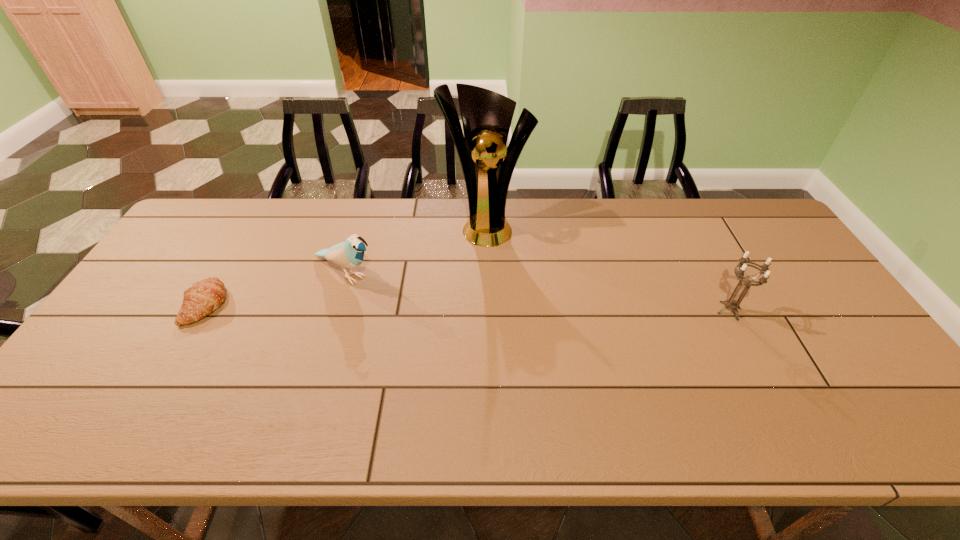
I want to click on crescent roll, so tap(200, 300).

You are a GUI agent. You are given a task and a screenshot of the screen. Output one action in this format:
    pyautogui.click(x=<x>, y=<y>)
    Task: Click on the leftmost object
    The height and width of the screenshot is (540, 960).
    Given the screenshot: What is the action you would take?
    pyautogui.click(x=200, y=300)

The width and height of the screenshot is (960, 540). I want to click on candle holder, so click(731, 303).

At what (x,y) coordinates should I click in order to perform the action: click on bird. Please return your answer as a coordinate pair (x, y). Looking at the image, I should click on (349, 254).

Locate an element on the screen. This screenshot has height=540, width=960. award is located at coordinates (486, 116).

You are a GUI agent. You are given a task and a screenshot of the screen. Output one action in this format:
    pyautogui.click(x=<x>, y=<y>)
    Task: Click on the tallest object
    The width and height of the screenshot is (960, 540).
    Given the screenshot: What is the action you would take?
    pyautogui.click(x=486, y=116)

Image resolution: width=960 pixels, height=540 pixels. I want to click on vacant region located 0.250m on the back of the crescent roll, so click(x=251, y=229).

What are the coordinates of `free space located 0.090m on the back of the rightmost object` in the screenshot? It's located at (711, 276).

Identify the location of vacant space located 0.290m at the face of the second object from left to right. This screenshot has width=960, height=540. (452, 329).

Where is `free space located 0.260m at the face of the second object from left to right`? free space located 0.260m at the face of the second object from left to right is located at coordinates (444, 325).